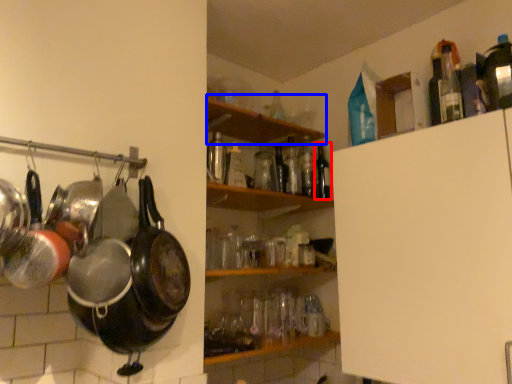
Question: Which object appears farthest to the camera in this image, bottle (highlighted by a red box) or shelf (highlighted by a blue box)?

Choices:
 (A) bottle
 (B) shelf

Answer: (A)